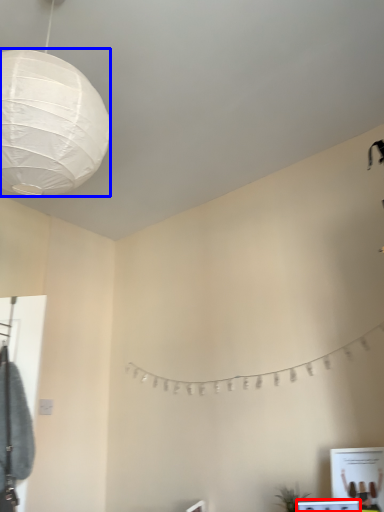
Question: Which object is further to the camera taking this photo, vanity (highlighted by a red box) or lantern (highlighted by a blue box)?

Choices:
 (A) vanity
 (B) lantern

Answer: (A)